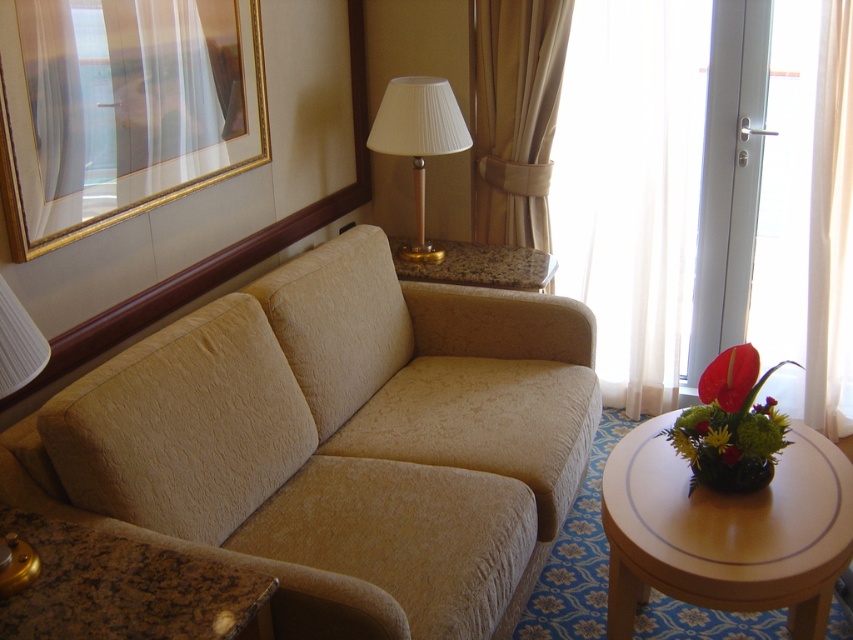
Question: Is matte beige lamp at upper center below yellow matte flower at center?

Choices:
 (A) no
 (B) yes

Answer: (A)

Question: Which object is the farthest from the matte beige lamp at upper center?

Choices:
 (A) white pleated fabric lampshade at center
 (B) beige fabric couch at center

Answer: (A)

Question: Which object is farther from the camera taking this photo?

Choices:
 (A) gold-framed picture at upper left
 (B) yellow matte flower at center

Answer: (B)

Question: Which point is closer to the camera taking this photo?

Choices:
 (A) (10, 304)
 (B) (59, 147)

Answer: (A)

Question: Does white pleated fabric lampshade at center lie in front of yellow matte flower at center?

Choices:
 (A) no
 (B) yes

Answer: (A)

Question: Can you confirm if white pleated fabric lampshade at center is thinner than granite-like side table at center?

Choices:
 (A) no
 (B) yes

Answer: (B)